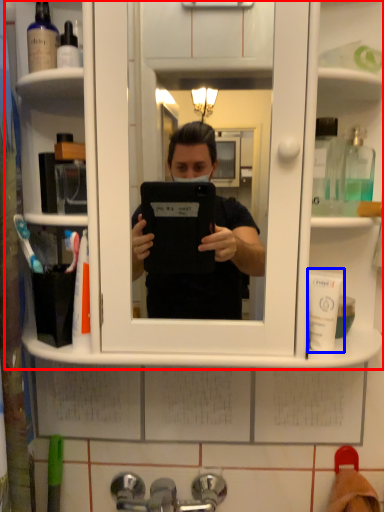
Question: Which of the following is the farthest to the observer, cabinet (highlighted by a red box) or mouthwash (highlighted by a blue box)?

Choices:
 (A) cabinet
 (B) mouthwash

Answer: (B)